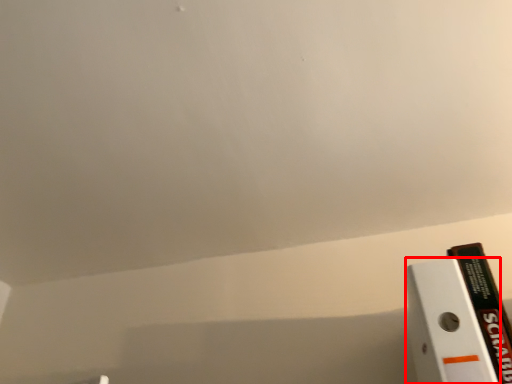
Question: From the image's perspective, where is paperback book (annotated by the red box) located in relation to book in the image?

Choices:
 (A) below
 (B) above

Answer: (B)